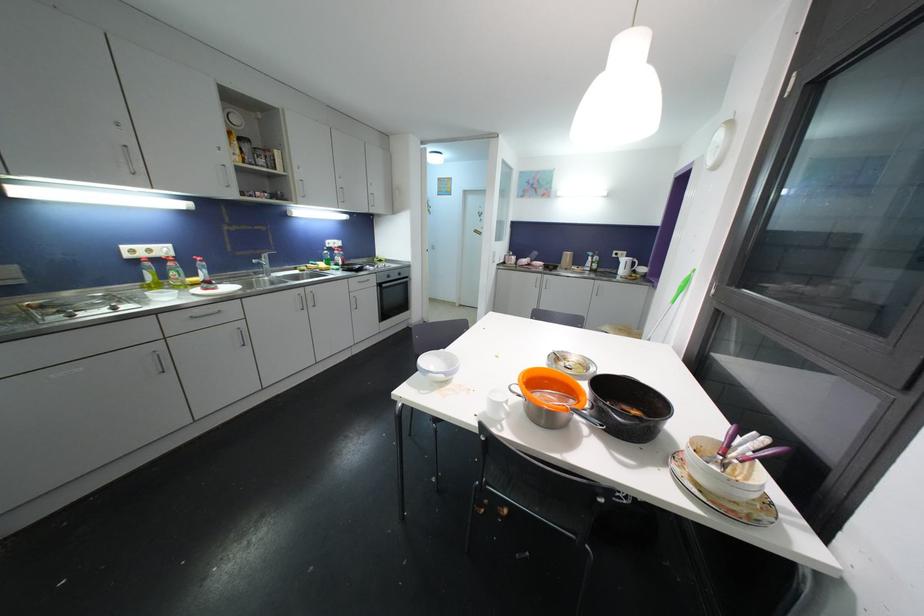
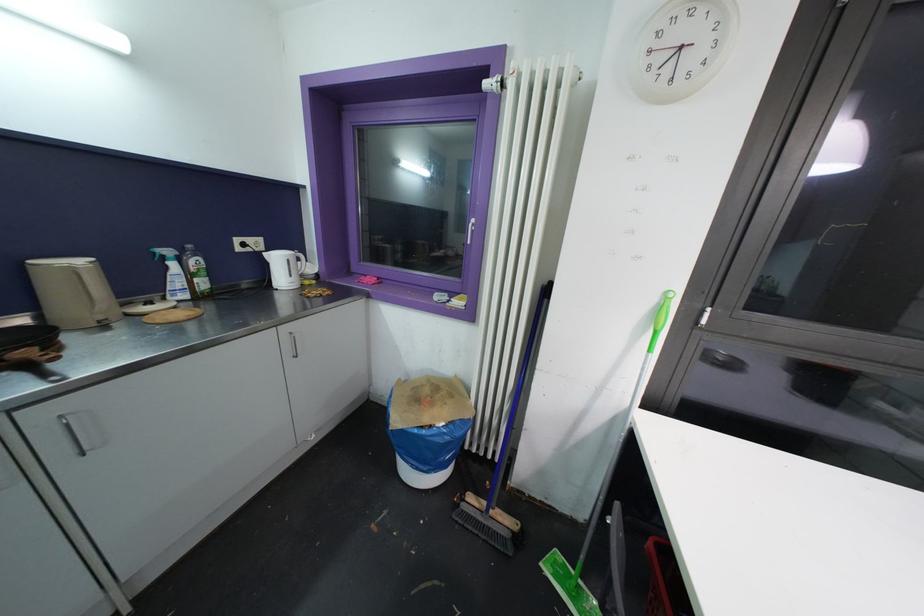
In the second image, find the point that corresponds to point (592, 261) in the first image.

(176, 267)